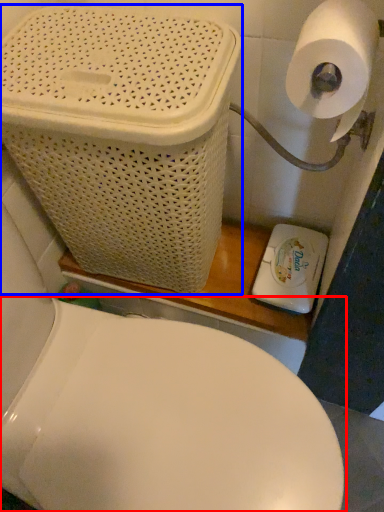
Question: Which object appears closest to the camera in this image, toilet (highlighted by a red box) or basket container (highlighted by a blue box)?

Choices:
 (A) toilet
 (B) basket container

Answer: (A)